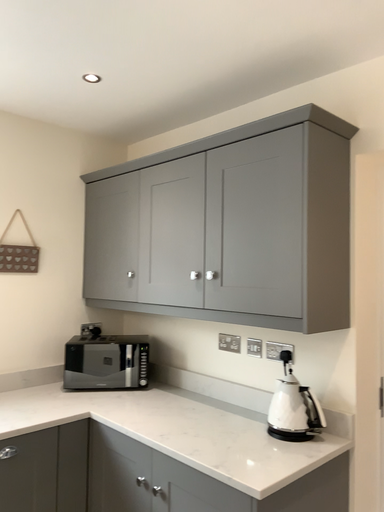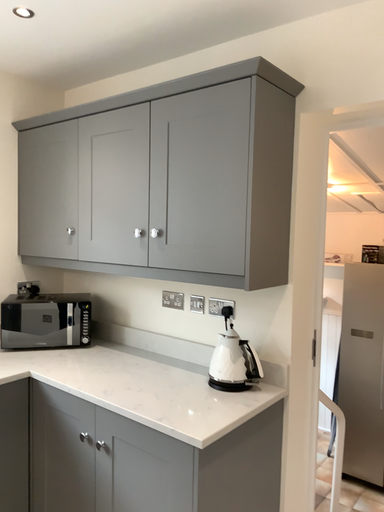
Question: How did the camera likely rotate when shooting the video?

Choices:
 (A) rotated left
 (B) rotated right

Answer: (B)